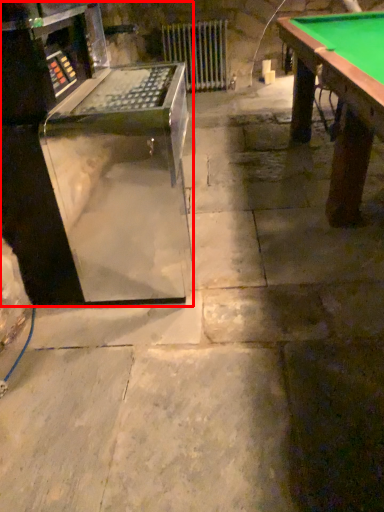
Question: In this image, where is equipment (annotated by the red box) located relative to radiator?

Choices:
 (A) right
 (B) left

Answer: (B)